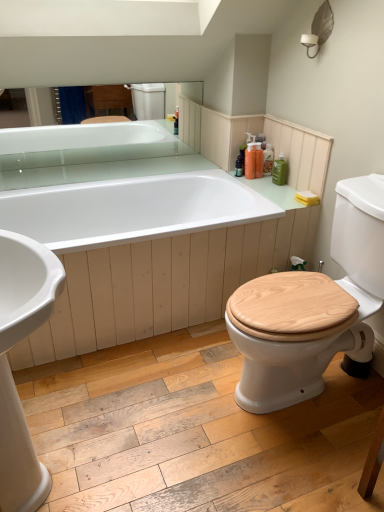
Question: Should I look upward or downward to see wooden at right?

Choices:
 (A) down
 (B) up

Answer: (A)

Question: From the image's perspective, is translucent plastic bottles at upper right, which is counted as the second toiletry, starting from the left, under green matte bottle at upper right, the 1th toiletry viewed from the right?

Choices:
 (A) yes
 (B) no

Answer: (B)

Question: Does translucent plastic bottles at upper right, the second toiletry in the right-to-left sequence, have a lesser height compared to green matte bottle at upper right, the 1th toiletry viewed from the right?

Choices:
 (A) no
 (B) yes

Answer: (A)

Question: Is translucent plastic bottles at upper right, which is counted as the second toiletry, starting from the left, closer to the viewer compared to green matte bottle at upper right, the 3th toiletry in the left-to-right sequence?

Choices:
 (A) no
 (B) yes

Answer: (A)

Question: Are translucent plastic bottles at upper right, which is counted as the second toiletry, starting from the left, and green matte bottle at upper right, the 1th toiletry viewed from the right, far apart?

Choices:
 (A) no
 (B) yes

Answer: (A)

Question: Is green matte bottle at upper right, the 1th toiletry viewed from the right, at the back of translucent plastic bottles at upper right, which is counted as the second toiletry, starting from the left?

Choices:
 (A) yes
 (B) no

Answer: (B)

Question: Considering the relative positions of translucent plastic bottles at upper right, which is counted as the second toiletry, starting from the left, and green matte bottle at upper right, the 1th toiletry viewed from the right, in the image provided, is translucent plastic bottles at upper right, which is counted as the second toiletry, starting from the left, to the right of green matte bottle at upper right, the 1th toiletry viewed from the right, from the viewer's perspective?

Choices:
 (A) no
 (B) yes

Answer: (A)

Question: Is wooden at right wider than translucent plastic bottles at upper right, which is counted as the second toiletry, starting from the left?

Choices:
 (A) yes
 (B) no

Answer: (A)

Question: Does wooden at right appear on the left side of translucent plastic bottles at upper right, which is counted as the second toiletry, starting from the left?

Choices:
 (A) no
 (B) yes

Answer: (A)

Question: Does wooden at right lie behind translucent plastic bottles at upper right, the second toiletry in the right-to-left sequence?

Choices:
 (A) no
 (B) yes

Answer: (A)

Question: Is wooden at right to the right of translucent plastic bottles at upper right, which is counted as the second toiletry, starting from the left, from the viewer's perspective?

Choices:
 (A) no
 (B) yes

Answer: (B)

Question: Is wooden at right looking in the opposite direction of translucent plastic bottles at upper right, which is counted as the second toiletry, starting from the left?

Choices:
 (A) no
 (B) yes

Answer: (A)

Question: From a real-world perspective, is wooden at right on translucent plastic bottles at upper right, the second toiletry in the right-to-left sequence?

Choices:
 (A) yes
 (B) no

Answer: (B)

Question: Is translucent plastic bottles at upper right, which is counted as the second toiletry, starting from the left, in front of translucent orange bottle at upper right, marked as the first toiletry in a left-to-right arrangement?

Choices:
 (A) yes
 (B) no

Answer: (B)